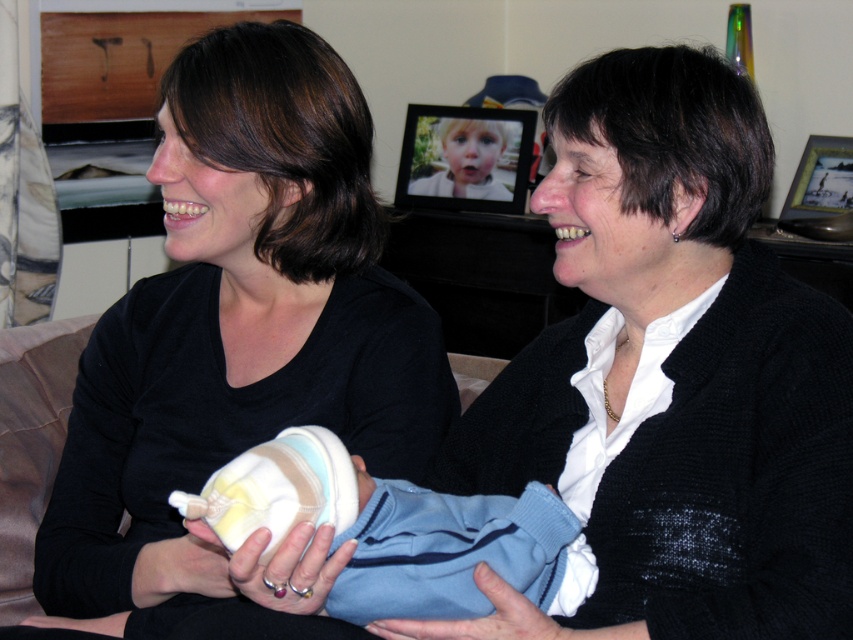
Is matte black sweater at center closer to camera compared to white soft fabric baby at center?

No, it is not.

Between point (682, 333) and point (373, 499), which one is positioned in front?

Point (373, 499) is more forward.

Is point (721, 634) farther from camera compared to point (410, 513)?

That is False.

What are the coordinates of `matte black sweater at center` in the screenshot? It's located at (672, 376).

Between matte black sweater at center and matte black shirt at center, which one has less height?

matte black sweater at center is shorter.

Image resolution: width=853 pixels, height=640 pixels. In order to click on matte black sweater at center in this screenshot , I will do `click(672, 376)`.

Does matte black shirt at center lie behind white soft fabric baby at center?

Yes, matte black shirt at center is further from the viewer.

Is matte black shirt at center smaller than white soft fabric baby at center?

No, matte black shirt at center is not smaller than white soft fabric baby at center.

Between point (206, 106) and point (267, 509), which one is positioned behind?

Point (206, 106)

This screenshot has width=853, height=640. I want to click on matte black shirt at center, so click(236, 330).